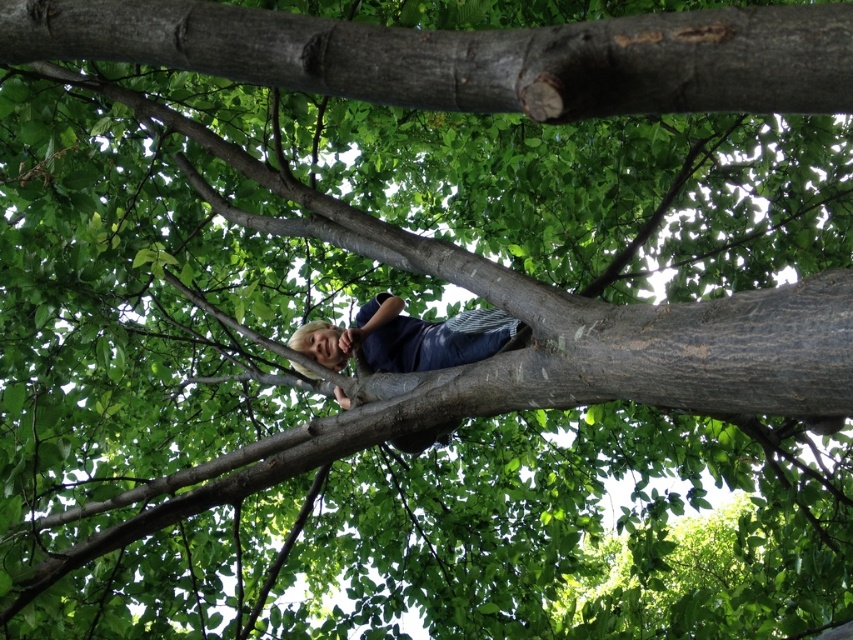
You are standing below the tree and looking up. You see two points marked on the branches. The first point is at coordinates point (798, 77) and the second is at point (489, 310). Which point is closer to you?

Point (798, 77) is in front of point (489, 310), so it is closer to you.

You are a photographer aiming to capture the blonde hair at center and the smooth gray tree trunk at upper center in a single shot. Which object should you focus on first if you want to ensure both are in frame without moving the camera?

You should focus on the smooth gray tree trunk at upper center first because it is smaller than the blonde hair at center, making it easier to frame within the camera view without needing to adjust the camera position.

You are a photographer aiming to capture a clear shot of the blonde hair at center and the smooth gray tree trunk at upper center. Which object will appear closer to the camera in the photo?

The smooth gray tree trunk at upper center will appear closer to the camera because it is in front of the blonde hair at center.